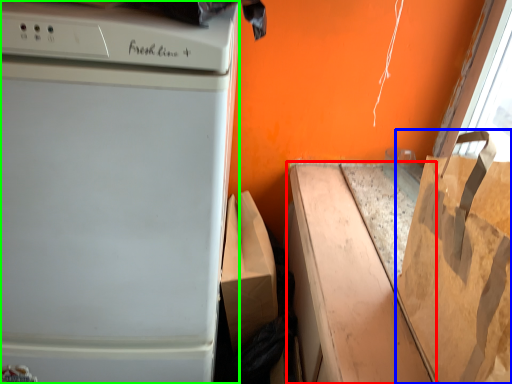
Question: Which is nearer to the cardboard box (highlighted by a red box)? grocery bag (highlighted by a blue box) or home appliance (highlighted by a green box).

Choices:
 (A) grocery bag
 (B) home appliance

Answer: (A)